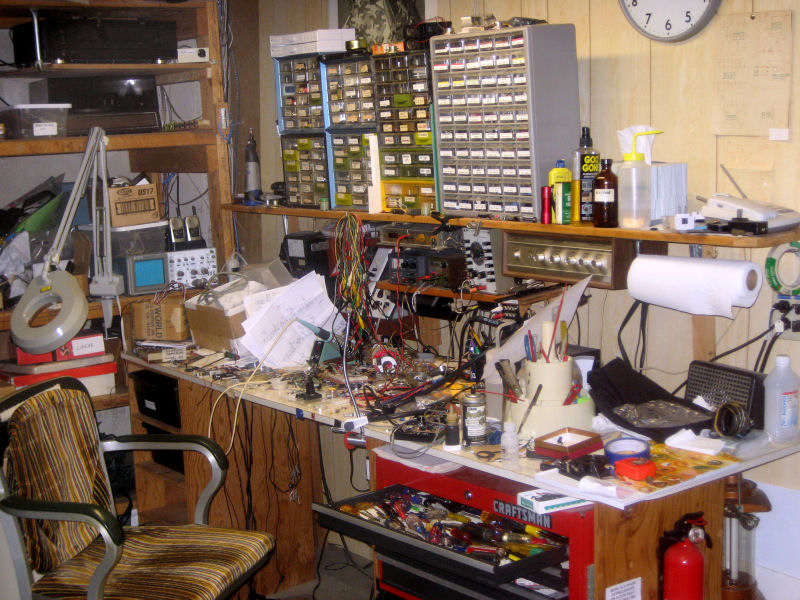
At what (x,y) coordinates should I click in order to perform the action: click on wall. Please return your answer as a coordinate pair (x, y). The image size is (800, 600). Looking at the image, I should click on (730, 91), (22, 165), (330, 453), (790, 469).